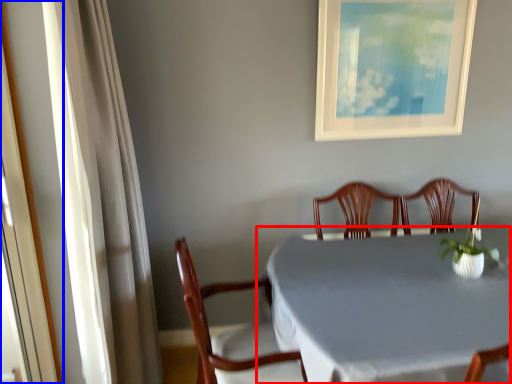
Question: Among these objects, which one is farthest to the camera, table (highlighted by a red box) or screen door (highlighted by a blue box)?

Choices:
 (A) table
 (B) screen door

Answer: (A)